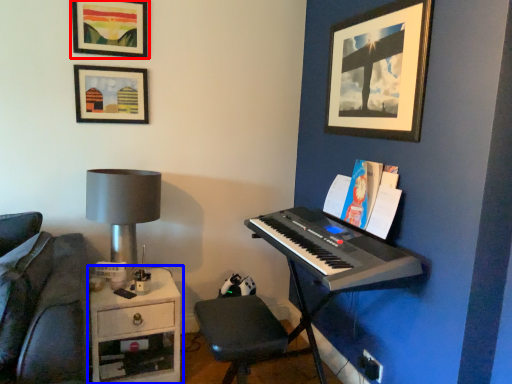
Question: Among these objects, which one is farthest to the camera, picture frame (highlighted by a red box) or table (highlighted by a blue box)?

Choices:
 (A) picture frame
 (B) table

Answer: (A)